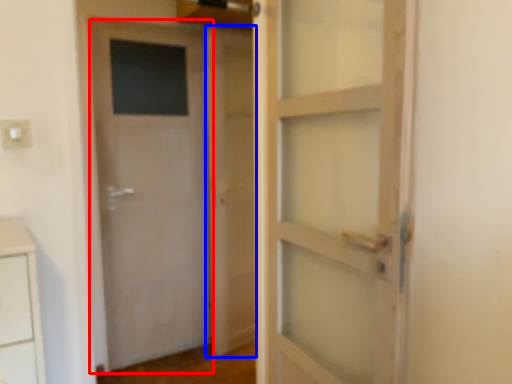
Question: Which object is closer to the camera taking this photo, door (highlighted by a red box) or barn door (highlighted by a blue box)?

Choices:
 (A) door
 (B) barn door

Answer: (A)